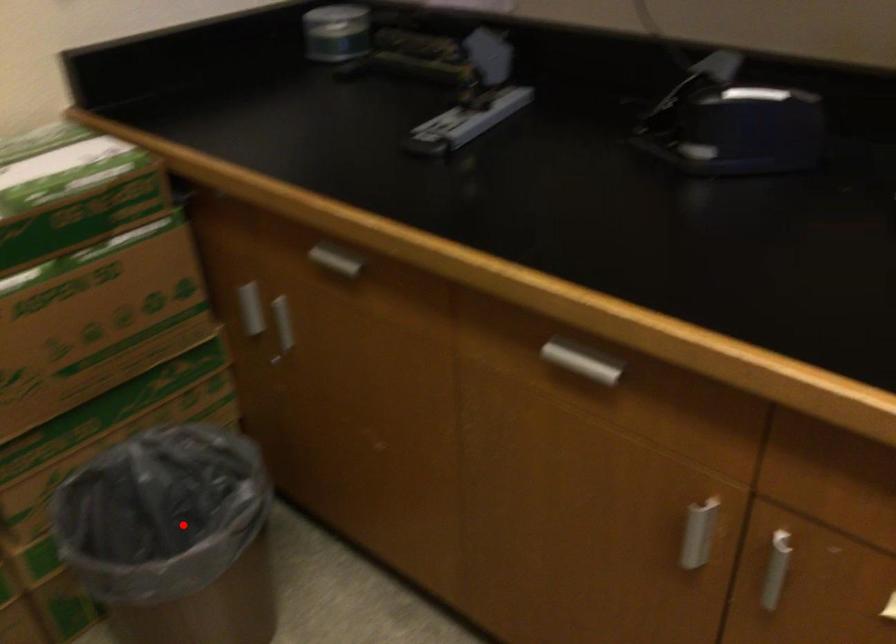
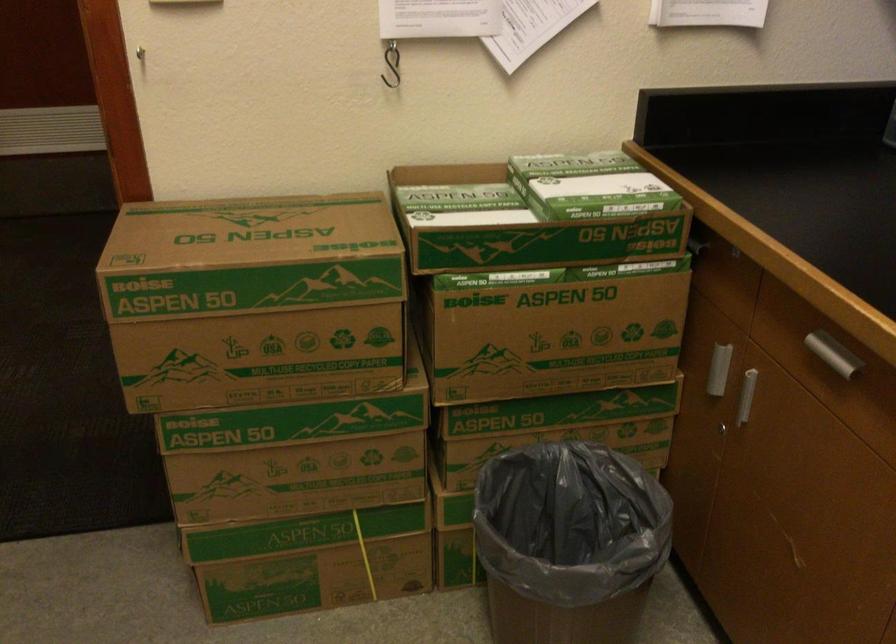
Where in the second image is the point corresponding to the highlighted location from the first image?

(569, 543)